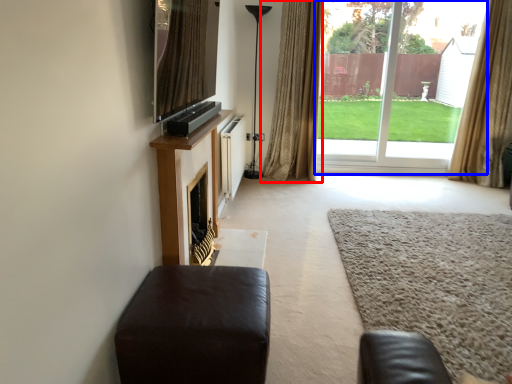
Question: Which point is closer to the camera, curtain (highlighted by a red box) or window frame (highlighted by a blue box)?

Choices:
 (A) curtain
 (B) window frame

Answer: (A)